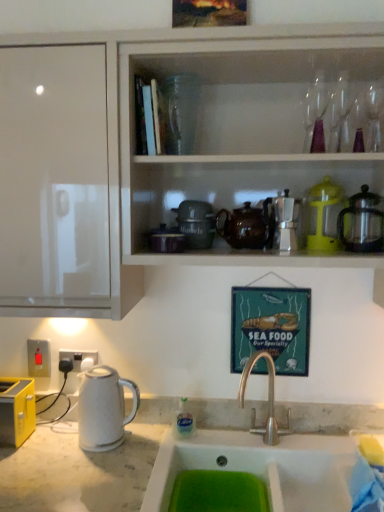
Question: From a real-world perspective, is satin silver coffee pot at upper right, acting as the 1th appliance starting from the right, beneath white glossy electric kettle at left?

Choices:
 (A) yes
 (B) no

Answer: (B)

Question: Is satin silver coffee pot at upper right, which is the 3th appliance in left-to-right order, turned away from white glossy electric kettle at left?

Choices:
 (A) no
 (B) yes

Answer: (A)

Question: Is white glossy electric kettle at left inside satin silver coffee pot at upper right, which is the 3th appliance in left-to-right order?

Choices:
 (A) no
 (B) yes

Answer: (A)

Question: Is satin silver coffee pot at upper right, which is the 3th appliance in left-to-right order, not close to white glossy electric kettle at left?

Choices:
 (A) no
 (B) yes

Answer: (A)

Question: Considering the relative sizes of satin silver coffee pot at upper right, which is the 3th appliance in left-to-right order, and white glossy electric kettle at left in the image provided, is satin silver coffee pot at upper right, which is the 3th appliance in left-to-right order, bigger than white glossy electric kettle at left?

Choices:
 (A) yes
 (B) no

Answer: (B)

Question: From a real-world perspective, is satin silver coffee pot at upper right, acting as the 1th appliance starting from the right, physically above white glossy electric kettle at left?

Choices:
 (A) yes
 (B) no

Answer: (A)

Question: Is white plastic electric outlet at lower left, acting as the 1th electric outlet starting from the right, outside metallic signboard at center?

Choices:
 (A) no
 (B) yes

Answer: (B)

Question: Could you tell me if white plastic electric outlet at lower left, acting as the 1th electric outlet starting from the right, is turned towards metallic signboard at center?

Choices:
 (A) yes
 (B) no

Answer: (B)

Question: From a real-world perspective, is white plastic electric outlet at lower left, acting as the 1th electric outlet starting from the right, under metallic signboard at center?

Choices:
 (A) no
 (B) yes

Answer: (B)

Question: Is white plastic electric outlet at lower left, which is the second electric outlet from left to right, at the left side of metallic signboard at center?

Choices:
 (A) no
 (B) yes

Answer: (B)

Question: Can you confirm if white plastic electric outlet at lower left, which is the second electric outlet from left to right, is smaller than metallic signboard at center?

Choices:
 (A) yes
 (B) no

Answer: (A)

Question: Is white glossy cabinet at upper center outside of metallic signboard at center?

Choices:
 (A) yes
 (B) no

Answer: (A)